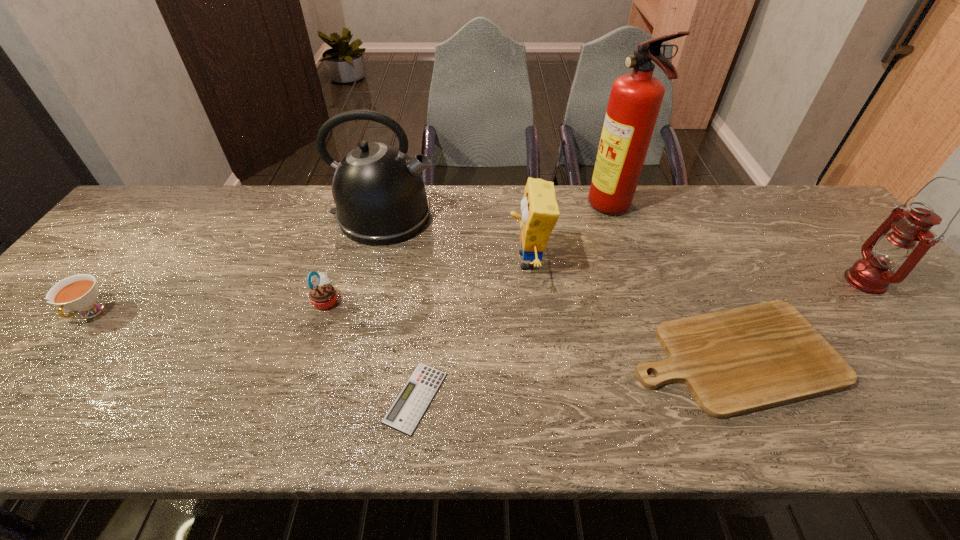
Where is `blank space located 0.210m on the front-facing side of the tallest object`? blank space located 0.210m on the front-facing side of the tallest object is located at coordinates (520, 208).

At what (x,y) coordinates should I click in order to perform the action: click on vacant space located 0.360m on the front-facing side of the tallest object. Please return your answer as a coordinate pair (x, y). The image size is (960, 540). Looking at the image, I should click on (471, 208).

Locate an element on the screen. The width and height of the screenshot is (960, 540). vacant region located 0.060m on the front-facing side of the tallest object is located at coordinates 569,208.

Locate an element on the screen. This screenshot has width=960, height=540. vacant space located 0.390m on the spout of the kettle is located at coordinates (565, 216).

Locate an element on the screen. This screenshot has width=960, height=540. free space located 0.070m on the front of the rightmost object is located at coordinates (900, 323).

Locate an element on the screen. This screenshot has height=540, width=960. blank area located 0.090m on the face of the sponge is located at coordinates (474, 261).

The height and width of the screenshot is (540, 960). What are the coordinates of `vacant space located on the face of the sponge` in the screenshot? It's located at (430, 261).

Find the location of `vacant area situated 0.180m on the face of the sponge`. vacant area situated 0.180m on the face of the sponge is located at coordinates (442, 261).

The image size is (960, 540). I want to click on free space located on the front-facing side of the muffin, so click(x=399, y=300).

This screenshot has height=540, width=960. What are the coordinates of `free space located 0.220m on the side of the sixth tallest object with the handle` in the screenshot? It's located at (7, 420).